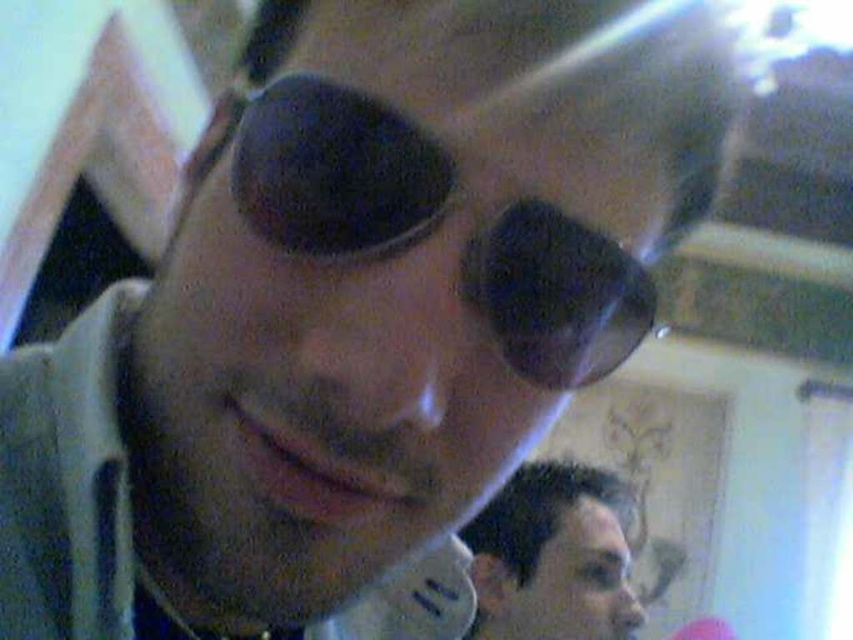
Question: Considering the relative positions of black rubber goggles at center and dark brown hair at lower right in the image provided, where is black rubber goggles at center located with respect to dark brown hair at lower right?

Choices:
 (A) left
 (B) right

Answer: (A)

Question: Which of the following is the farthest from the observer?

Choices:
 (A) (526, 529)
 (B) (344, 220)

Answer: (A)

Question: Is black rubber goggles at center bigger than dark brown hair at lower right?

Choices:
 (A) yes
 (B) no

Answer: (B)

Question: Which point appears closest to the camera in this image?

Choices:
 (A) [x=512, y=211]
 (B) [x=573, y=596]

Answer: (A)

Question: Does black rubber goggles at center appear over dark brown hair at lower right?

Choices:
 (A) yes
 (B) no

Answer: (A)

Question: Which point appears closest to the camera in this image?

Choices:
 (A) (572, 634)
 (B) (547, 276)

Answer: (B)